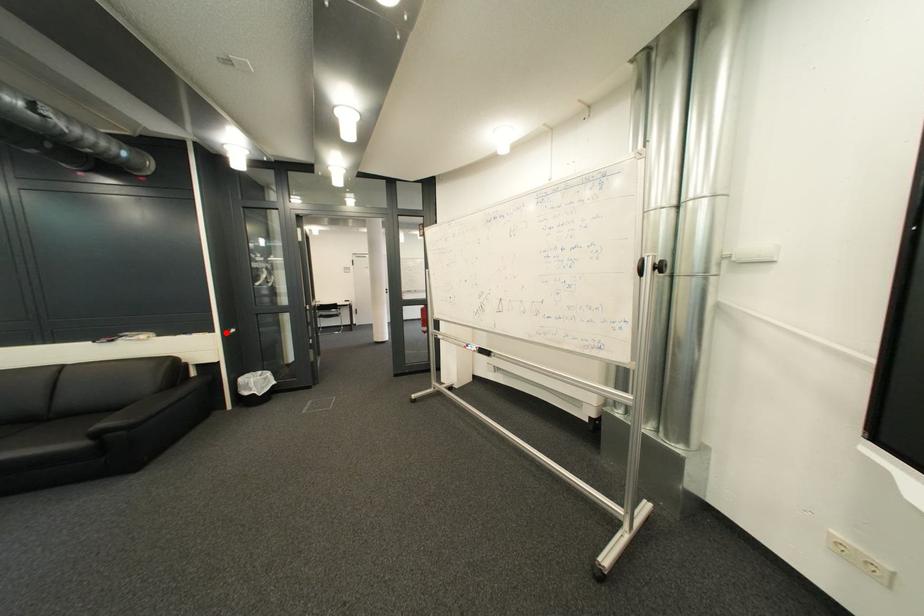
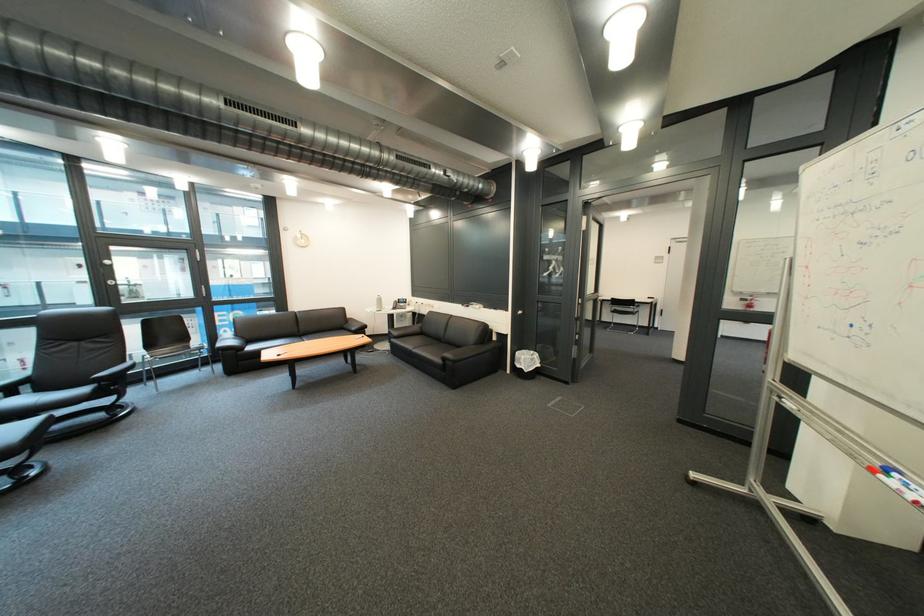
Question: A red point is marked in image1. In image2, is the corresponding 3D point closer to the camera or farther? Reply with the corresponding letter.

Choices:
 (A) The corresponding 3D point is closer.
 (B) The corresponding 3D point is farther.

Answer: (B)